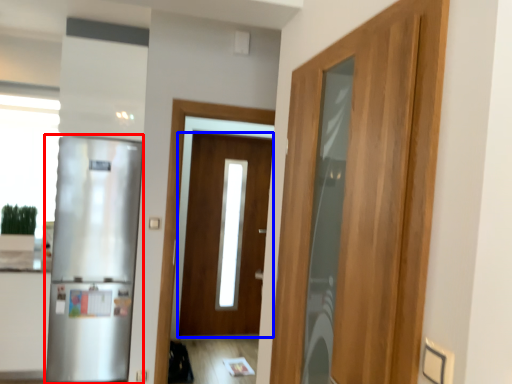
Question: Which point is further to the camera, refrigerator (highlighted by a red box) or door (highlighted by a blue box)?

Choices:
 (A) refrigerator
 (B) door

Answer: (B)